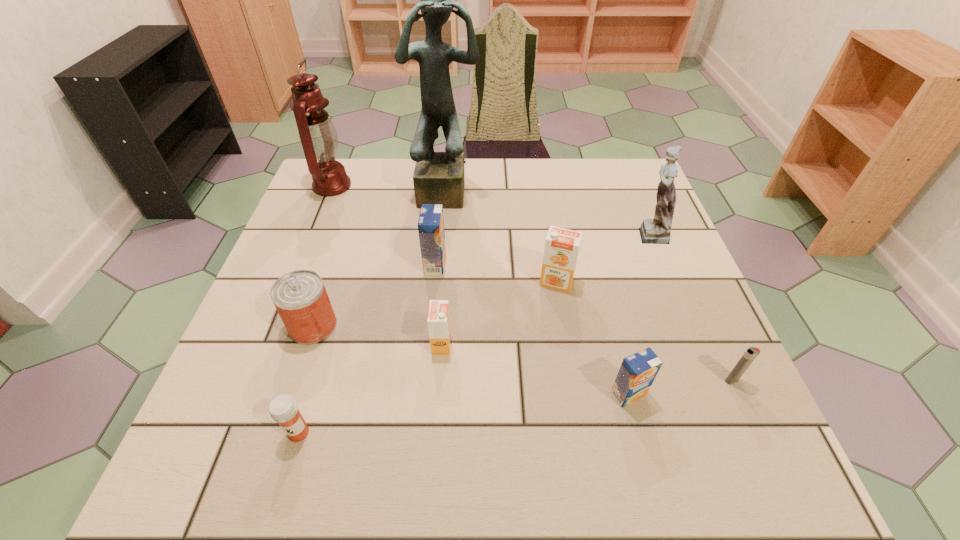
Where is `vacant area that satisfies the following two spatial constraints: 1. on the front-facing side of the eighth shortest object; 2. on the label side of the medicine`? Image resolution: width=960 pixels, height=540 pixels. vacant area that satisfies the following two spatial constraints: 1. on the front-facing side of the eighth shortest object; 2. on the label side of the medicine is located at coordinates (730, 433).

What are the coordinates of `vacant space that satisfies the following two spatial constraints: 1. on the front side of the left blue orange_juice; 2. on the left side of the bigger orange orange juice` in the screenshot? It's located at (433, 282).